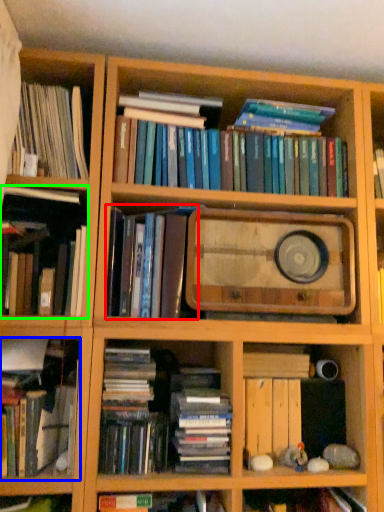
Question: Estimate the real-world distances between objects in this image. Which object is closer to book (highlighted by a red box), book (highlighted by a blue box) or book (highlighted by a green box)?

Choices:
 (A) book
 (B) book

Answer: (B)